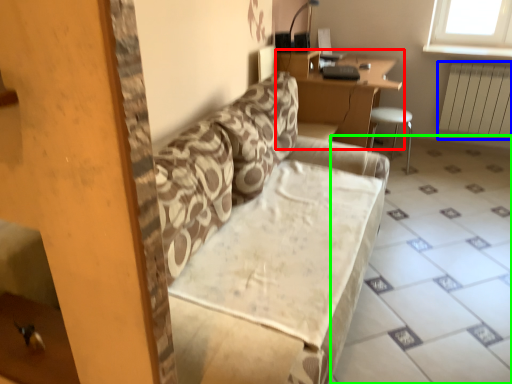
Question: Which object is the closest to the table (highlighted by a red box)? Choose among these: radiator (highlighted by a blue box) or tile (highlighted by a green box).

Choices:
 (A) radiator
 (B) tile

Answer: (B)